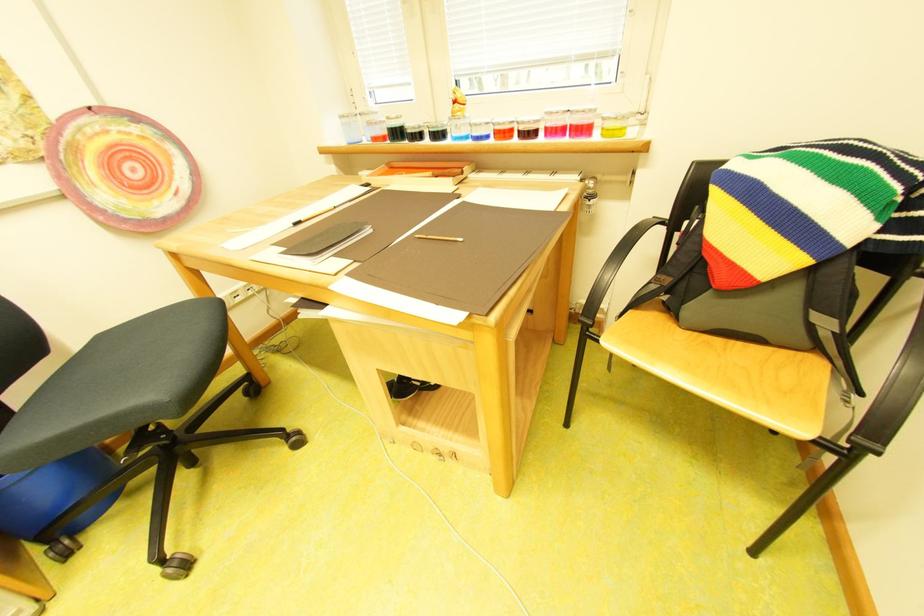
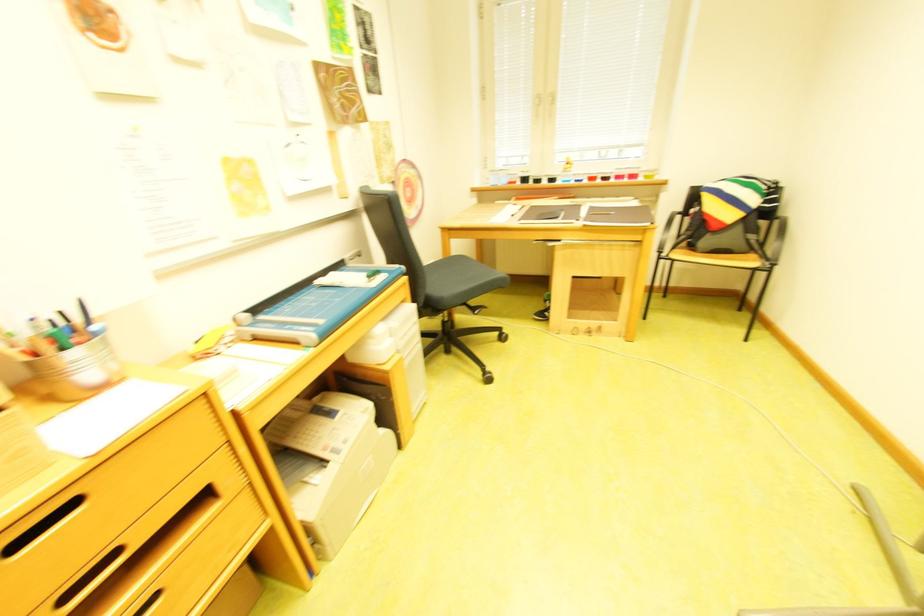
What movement of the cameraman would produce the second image?

The cameraman moved toward left, backward.